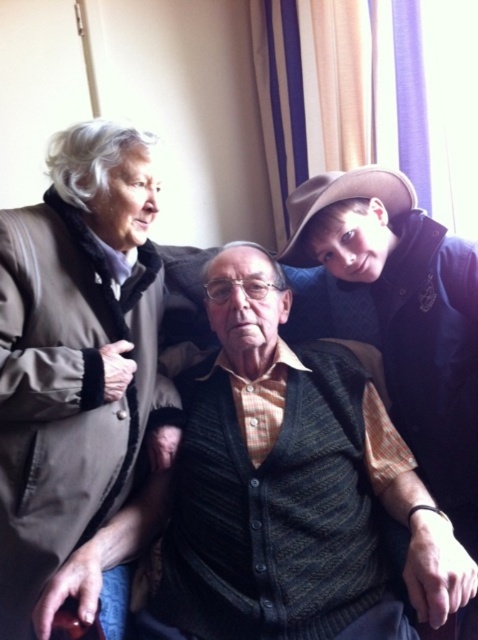
Question: Which of the following is the farthest from the observer?

Choices:
 (A) (271, 548)
 (B) (11, 444)

Answer: (A)

Question: Which point is closer to the camera taking this photo?

Choices:
 (A) (318, 582)
 (B) (36, 460)

Answer: (B)

Question: Does matte brown coat at left lie behind knitted dark green vest at center?

Choices:
 (A) no
 (B) yes

Answer: (B)

Question: In this image, where is matte brown coat at left located relative to knitted dark green vest at center?

Choices:
 (A) right
 (B) left

Answer: (B)

Question: Is matte brown coat at left to the left of knitted dark green vest at center from the viewer's perspective?

Choices:
 (A) yes
 (B) no

Answer: (A)